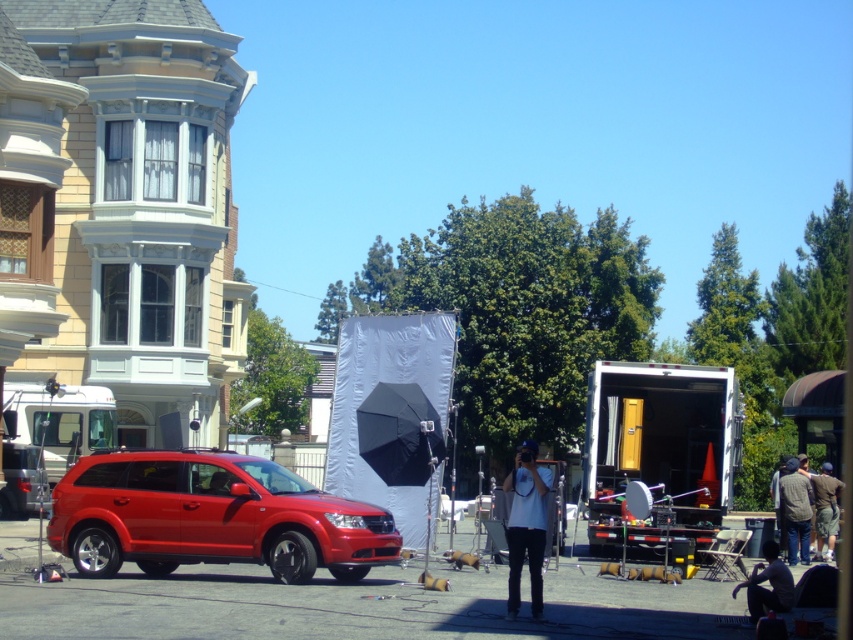
Can you confirm if shiny red suv at center is positioned to the right of white matte shirt at center?

No, shiny red suv at center is not to the right of white matte shirt at center.

Locate an element on the screen. This screenshot has width=853, height=640. shiny red suv at center is located at coordinates (212, 516).

Does white matte shirt at center have a smaller size compared to dark gray fabric at lower right?

No.

Does white matte shirt at center have a lesser height compared to dark gray fabric at lower right?

No, white matte shirt at center is not shorter than dark gray fabric at lower right.

Does point (544, 484) come farther from viewer compared to point (762, 554)?

No, (544, 484) is in front of (762, 554).

At what (x,y) coordinates should I click in order to perform the action: click on white matte shirt at center. Please return your answer as a coordinate pair (x, y). Looking at the image, I should click on (526, 525).

Does dark gray sweater at lower right have a smaller size compared to dark gray shorts at lower right?

Actually, dark gray sweater at lower right might be larger than dark gray shorts at lower right.

Can you confirm if dark gray sweater at lower right is taller than dark gray shorts at lower right?

Yes.

In the scene shown: Who is more distant from viewer, (802, 516) or (827, 472)?

Point (827, 472)

Find the location of a particular element. The width and height of the screenshot is (853, 640). dark gray sweater at lower right is located at coordinates (795, 509).